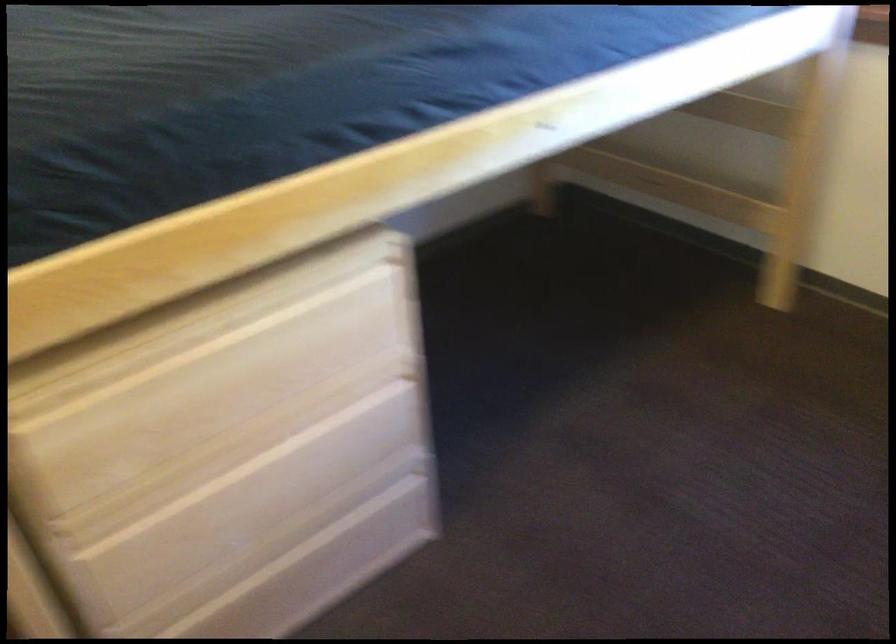
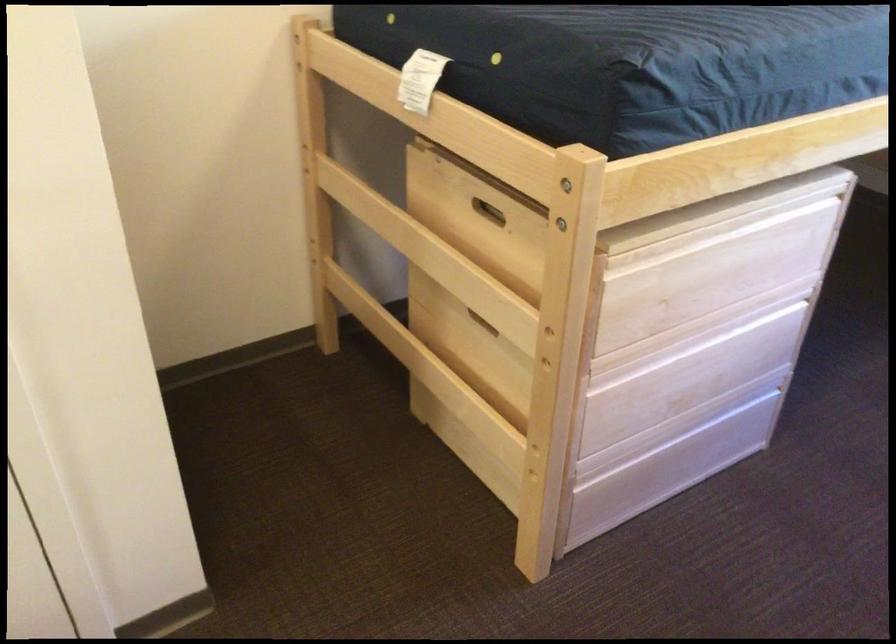
In the scene shown: What movement of the cameraman would produce the second image?

The cameraman moved toward left, backward.